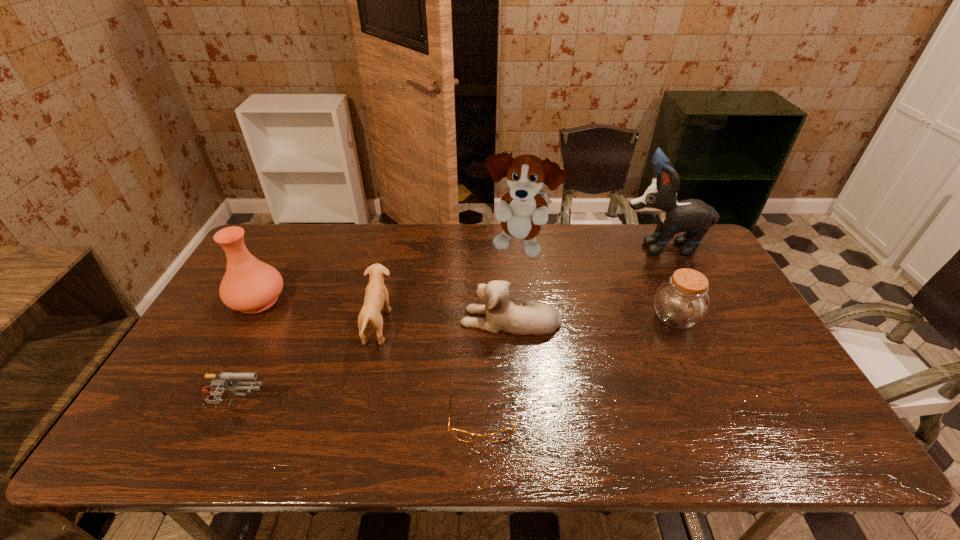
The image size is (960, 540). I want to click on free spot located 0.240m on the front of the jar, so click(x=718, y=413).

This screenshot has height=540, width=960. In order to click on vacant region located on the left side of the leftmost puppy in this screenshot , I will do 474,325.

Where is `vacant space located 0.160m at the barrel end of the second shortest object`? The width and height of the screenshot is (960, 540). vacant space located 0.160m at the barrel end of the second shortest object is located at coordinates (333, 406).

Where is `gun located in the near edge section of the desktop`? The image size is (960, 540). gun located in the near edge section of the desktop is located at coordinates (210, 396).

The width and height of the screenshot is (960, 540). Find the location of `spectacles that is positioned at the near edge`. spectacles that is positioned at the near edge is located at coordinates (461, 435).

Locate an element on the screen. This screenshot has width=960, height=540. vase present at the left edge is located at coordinates (249, 285).

Where is `gun present at the left edge`? This screenshot has height=540, width=960. gun present at the left edge is located at coordinates (210, 396).

Find the location of a particular element. The height and width of the screenshot is (540, 960). puppy located at the right edge is located at coordinates (694, 217).

You are a GUI agent. You are given a task and a screenshot of the screen. Output one action in this format:
    pyautogui.click(x=<x>, y=<y>)
    Task: Click on the jar located at the right edge
    
    Given the screenshot: What is the action you would take?
    pyautogui.click(x=681, y=302)

The image size is (960, 540). Identify the location of object positioned at the near left corner. (210, 396).